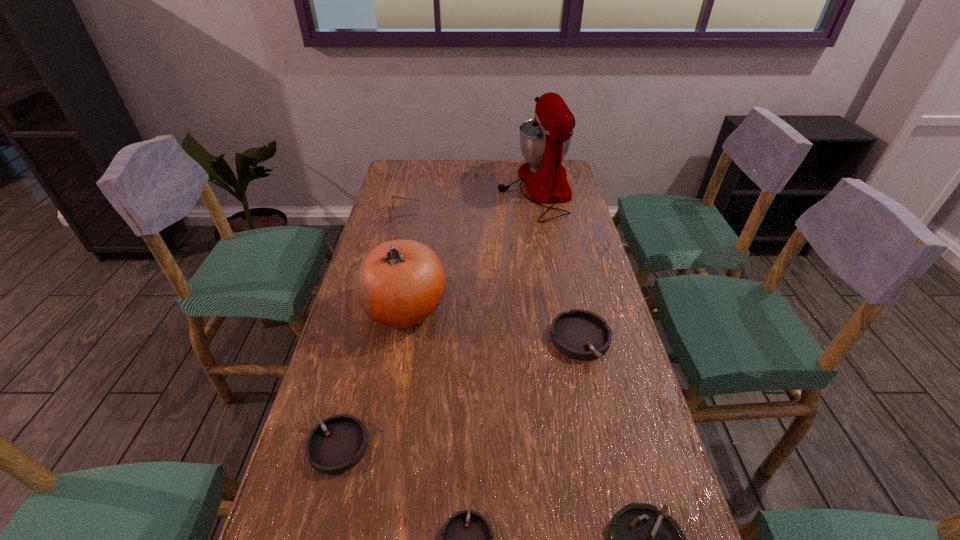
You are a GUI agent. You are given a task and a screenshot of the screen. Output one action in this format:
    pyautogui.click(x=<x>, y=<y>)
    Task: Click on the object that stands as the fourth closest to the orange pumpkin
    
    Given the screenshot: What is the action you would take?
    [x=545, y=140]

Where is `ashtray that is the closest to the yellow spectacles`? ashtray that is the closest to the yellow spectacles is located at coordinates (579, 334).

The width and height of the screenshot is (960, 540). Identify the location of ashtray that is the third closest one to the green ashtray. (335, 445).

Identify which gray ashtray is the nearest to the fourth object from left to right. Please provide its 2D coordinates. Your answer should be formatted as a tuple, i.e. [(x, y)], where the tuple contains the x and y coordinates of a point satisfying the conditions above.

[(335, 445)]

Identify which gray ashtray is the nearest to the orange pumpkin. Please provide its 2D coordinates. Your answer should be formatted as a tuple, i.e. [(x, y)], where the tuple contains the x and y coordinates of a point satisfying the conditions above.

[(335, 445)]

Identify the location of vacant space that satisfies the following two spatial constraints: 1. on the front-facing side of the spectacles; 2. on the back side of the rightmost gray ashtray. This screenshot has width=960, height=540. (375, 340).

This screenshot has width=960, height=540. I want to click on vacant region that satisfies the following two spatial constraints: 1. on the back side of the pumpkin; 2. on the left side of the leftmost gray ashtray, so coord(373,308).